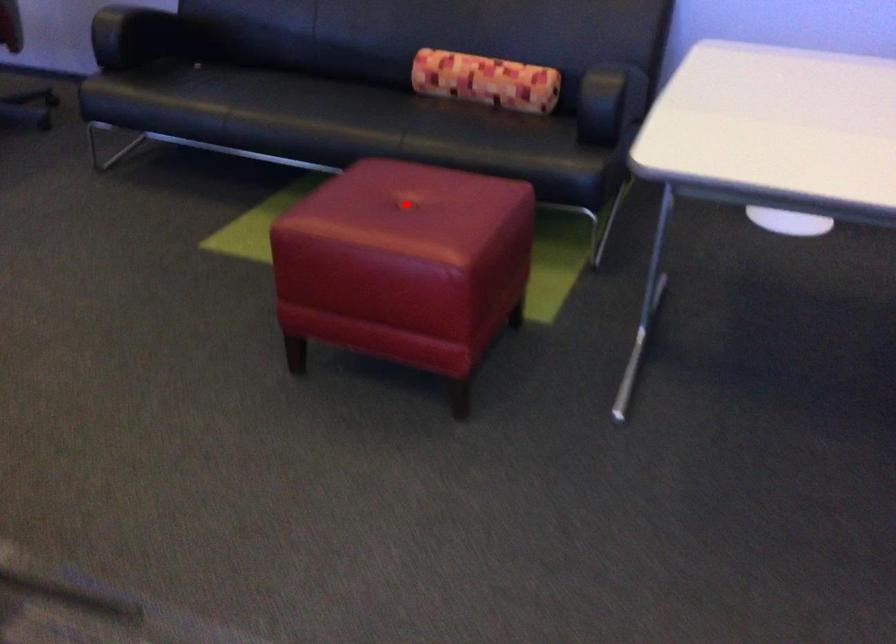
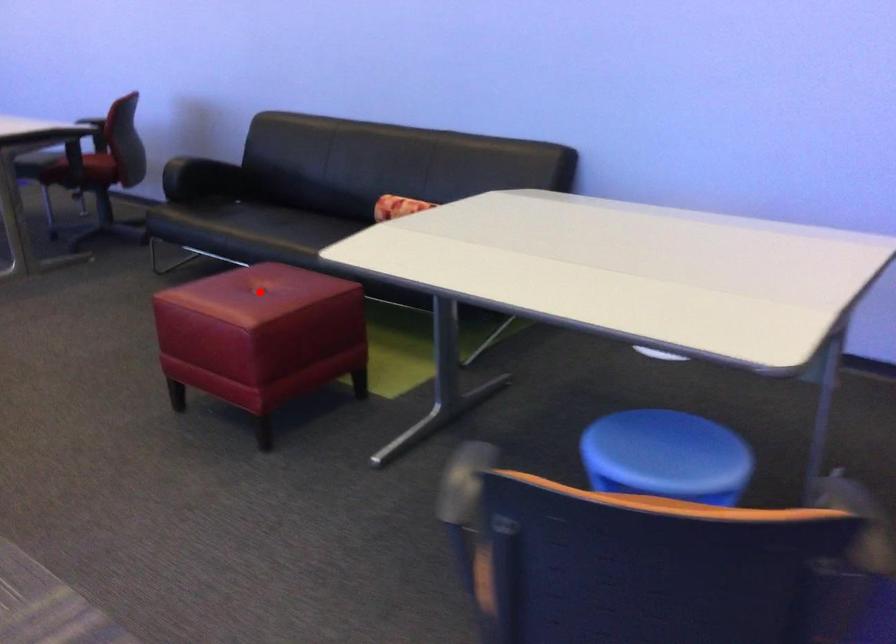
I am providing you with two images of the same scene from different viewpoints. A red point is marked on the first image and another point is marked on the second image. Is the marked point in image1 the same physical position as the marked point in image2?

Yes